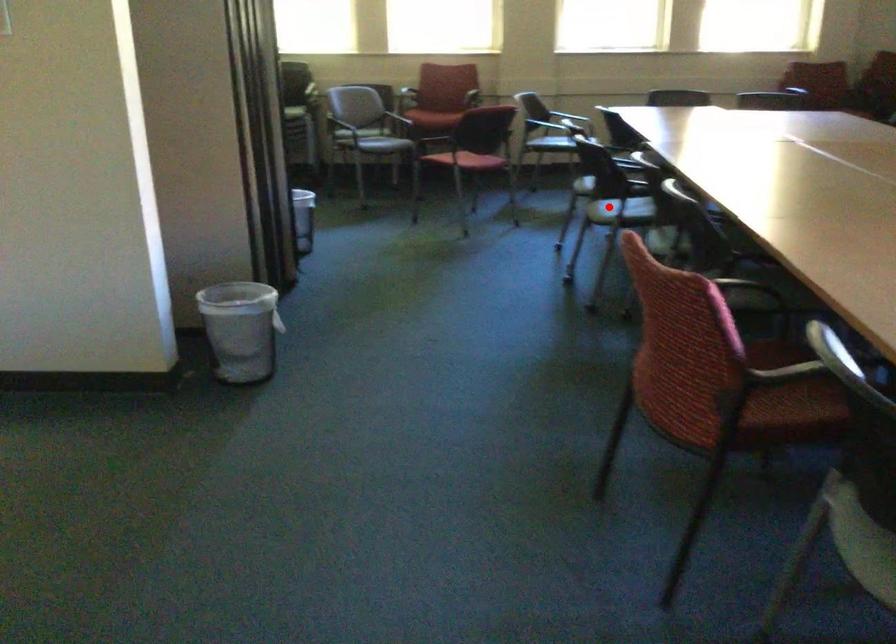
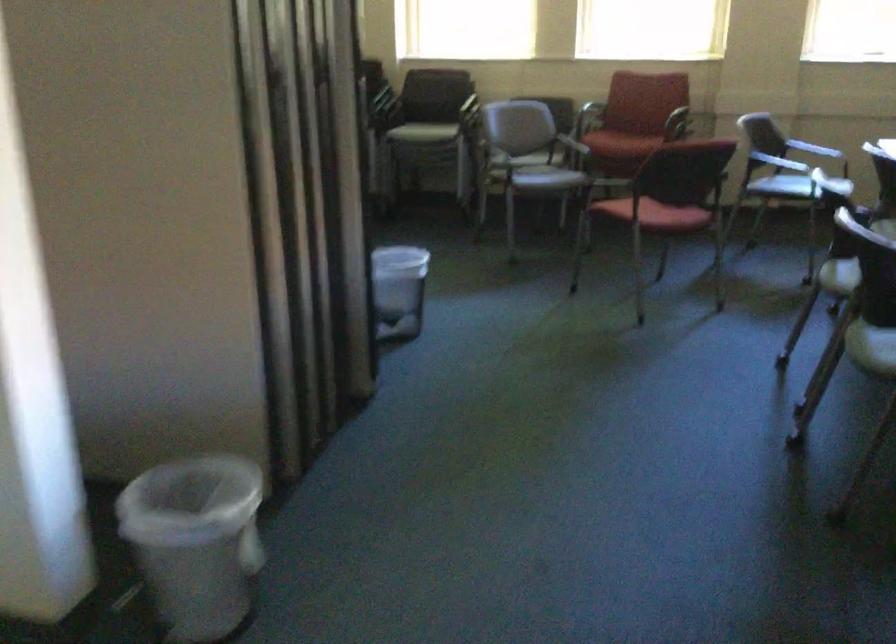
Question: I am providing you with two images of the same scene from different viewpoints. A red point is shown in image1. For the corresponding object point in image2, is it positioned nearer or farther from the camera?

Choices:
 (A) Nearer
 (B) Farther

Answer: (A)